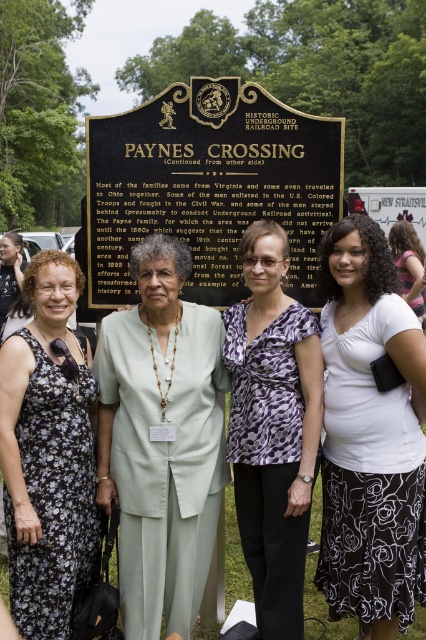
Question: Is white printed fabric skirt at lower right behind floral dress at left?

Choices:
 (A) yes
 (B) no

Answer: (B)

Question: Considering the relative positions of light green fabric at center and floral print dress at left in the image provided, where is light green fabric at center located with respect to floral print dress at left?

Choices:
 (A) left
 (B) right

Answer: (B)

Question: Which point is farther to the camera?

Choices:
 (A) floral dress at left
 (B) pink fabric shirt at center

Answer: (A)

Question: Estimate the real-world distances between objects in this image. Which object is closer to the floral print dress at left?

Choices:
 (A) gold/bronze plaque at center
 (B) pink fabric shirt at center

Answer: (A)

Question: Which object is closer to the camera taking this photo?

Choices:
 (A) light green fabric at center
 (B) gold/bronze plaque at center
 (C) pink fabric shirt at center

Answer: (A)

Question: Can you confirm if white printed fabric skirt at lower right is wider than floral print dress at left?

Choices:
 (A) no
 (B) yes

Answer: (A)